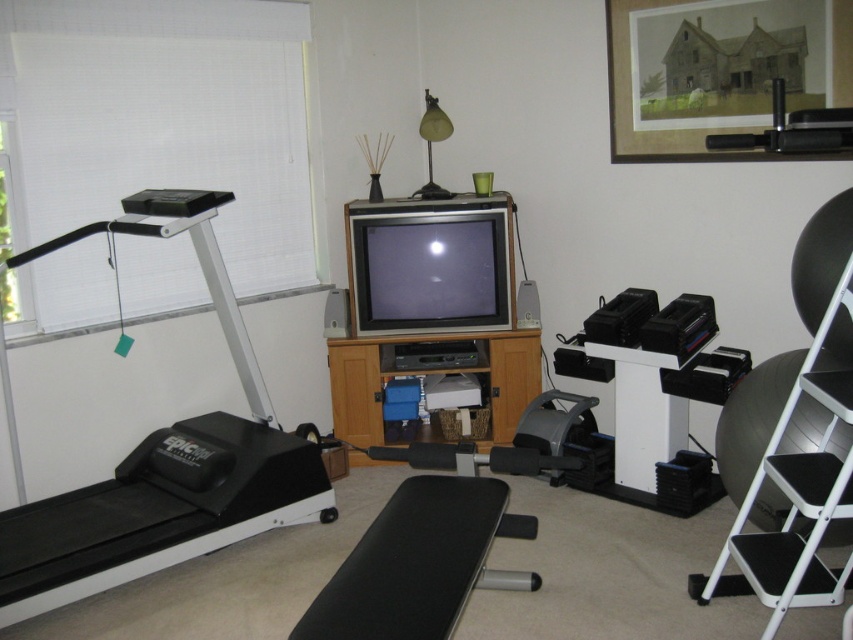
You are organizing a space in the home gym and need to move the white matte step ladder at right. Where should you place it so it doesn not block the wooden framed picture at upper center?

Place the white matte step ladder at right below the wooden framed picture at upper center since the picture is currently above the ladder.

You are organizing a space in the home gym and want to hang a new decoration. You notice the wooden framed picture at upper center and the wooden entertainment center at center. Which object is closer to you, and why?

The wooden framed picture at upper center is closer to you because it is in front of the wooden entertainment center at center.

You are planning to hang a new picture on the wall in your home gym. The current wooden framed picture at upper center is at coordinates 0.122, 0.855. If you want to place the new picture directly to the right of the existing one, what coordinates should you aim for?

To place the new picture directly to the right of the wooden framed picture at upper center located at coordinates (x=728, y=77), you should aim for coordinates slightly higher in the x value, such as (x=728, y=96). This maintains the same y position for alignment while shifting the x coordinate to the right.